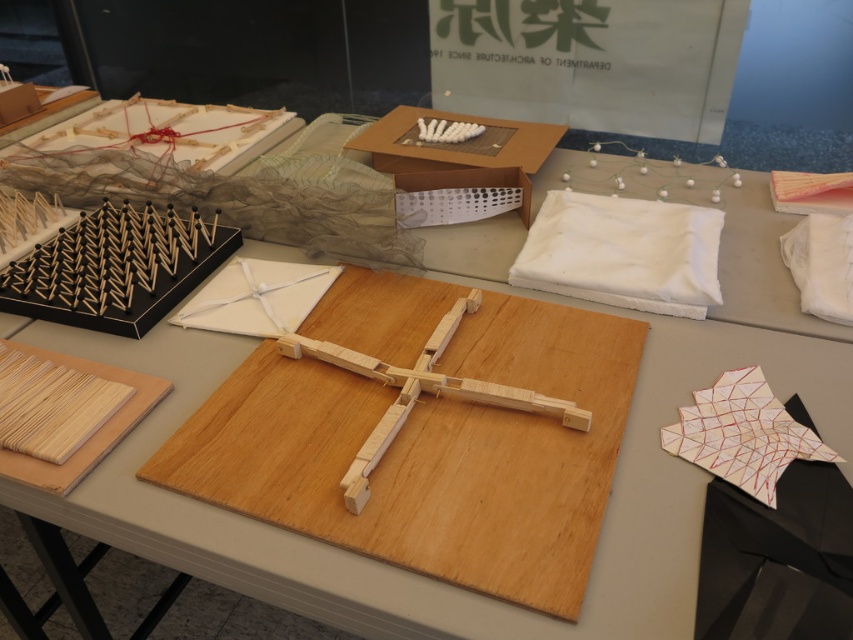
Question: Which point is closer to the camera taking this photo?

Choices:
 (A) (524, 140)
 (B) (515, 280)

Answer: (B)

Question: Which object is closer to the camera taking this photo?

Choices:
 (A) matte cardboard box at center
 (B) white fabric at upper right

Answer: (B)

Question: Observing the image, what is the correct spatial positioning of white fabric at upper right in reference to matte cardboard box at center?

Choices:
 (A) left
 (B) right

Answer: (B)

Question: Does white fabric at upper right appear on the left side of matte cardboard box at center?

Choices:
 (A) no
 (B) yes

Answer: (A)

Question: Where is white fabric at upper right located in relation to matte cardboard box at center in the image?

Choices:
 (A) left
 (B) right

Answer: (B)